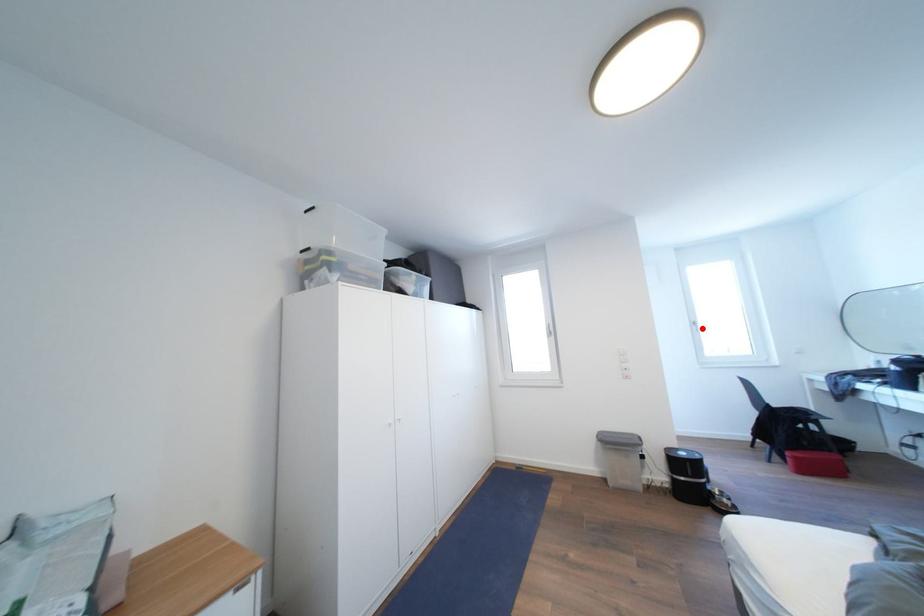
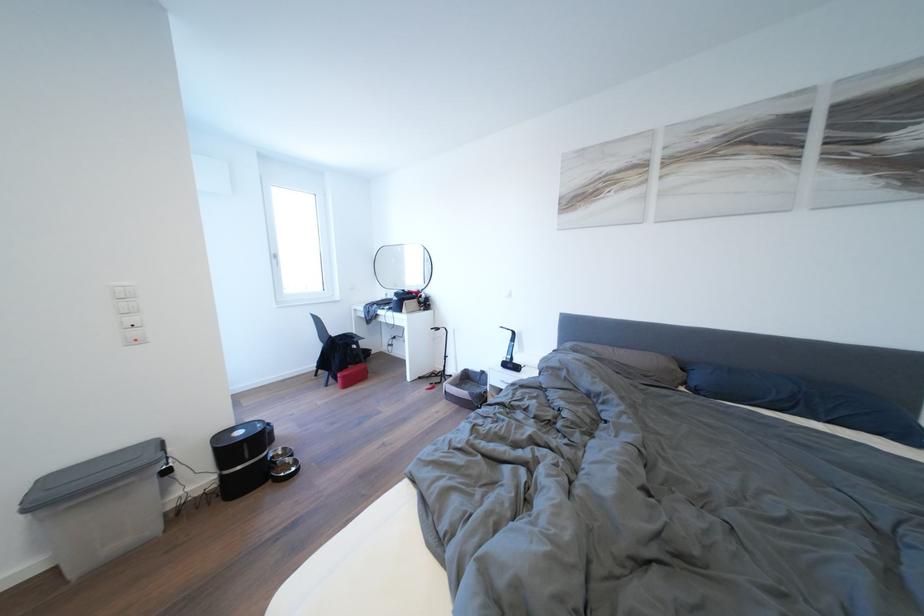
Question: A red point is marked in image1. In image2, is the corresponding 3D point closer to the camera or farther? Reply with the corresponding letter.

Choices:
 (A) The corresponding 3D point is closer.
 (B) The corresponding 3D point is farther.

Answer: (A)